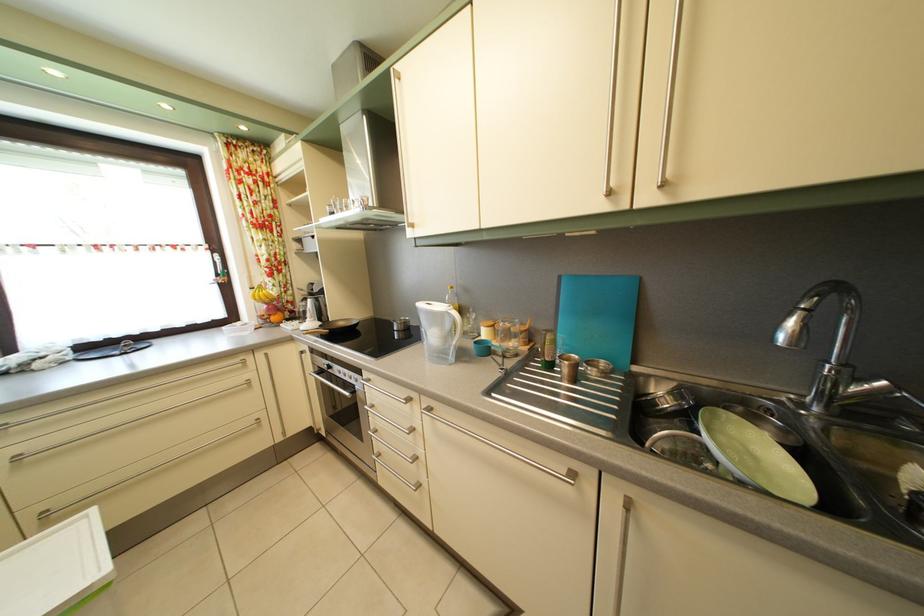
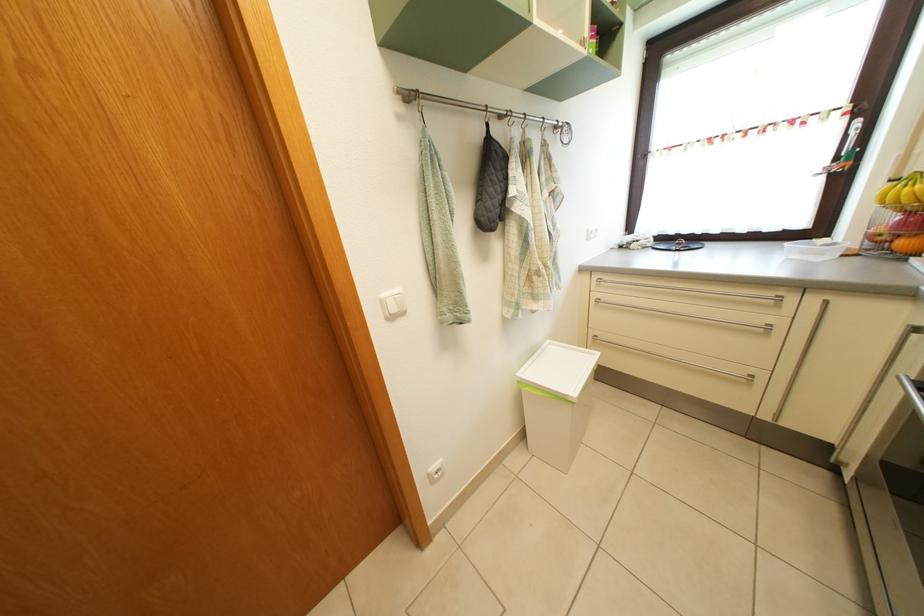
The point at (x=283, y=326) is marked in the first image. Where is the corresponding point in the second image?

(910, 252)